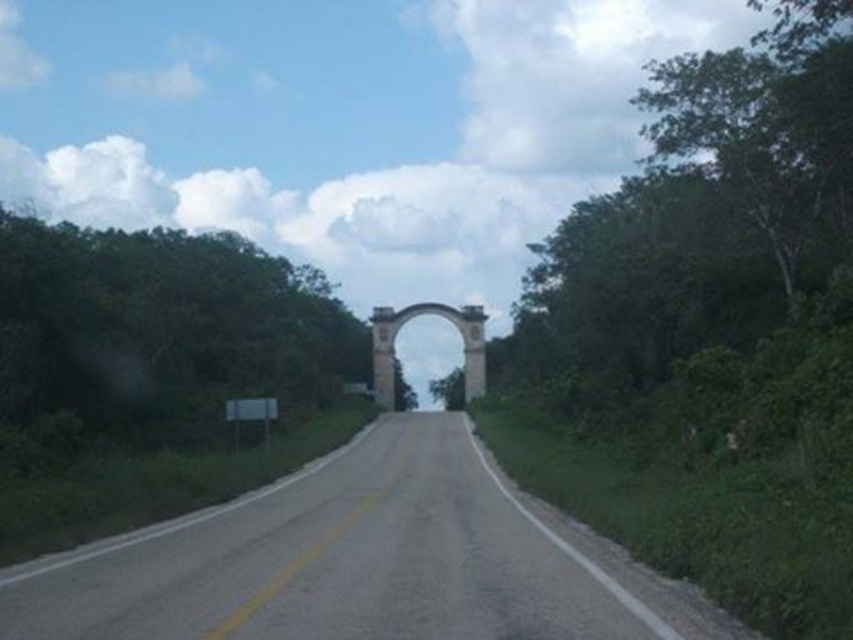
Who is lower down, asphalt road at center or white stone archway at center?

Positioned lower is asphalt road at center.

Which of these two, asphalt road at center or white stone archway at center, stands taller?

With more height is white stone archway at center.

This screenshot has width=853, height=640. What do you see at coordinates (363, 561) in the screenshot?
I see `asphalt road at center` at bounding box center [363, 561].

In order to click on asphalt road at center in this screenshot , I will do click(x=363, y=561).